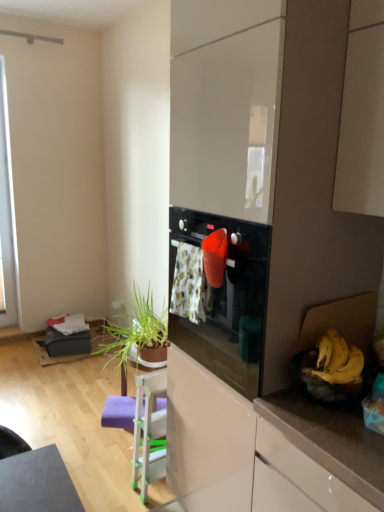
Question: Is the depth of white plastic chair at lower center less than that of floral fabric laundry at center?

Choices:
 (A) yes
 (B) no

Answer: (B)

Question: Would you consider white plastic chair at lower center to be distant from floral fabric laundry at center?

Choices:
 (A) no
 (B) yes

Answer: (A)

Question: From the image's perspective, does white plastic chair at lower center appear higher than floral fabric laundry at center?

Choices:
 (A) yes
 (B) no

Answer: (B)

Question: Is white plastic chair at lower center thinner than floral fabric laundry at center?

Choices:
 (A) yes
 (B) no

Answer: (B)

Question: Considering the relative sizes of white plastic chair at lower center and floral fabric laundry at center in the image provided, is white plastic chair at lower center taller than floral fabric laundry at center?

Choices:
 (A) no
 (B) yes

Answer: (B)

Question: Could you tell me if white plastic chair at lower center is facing floral fabric laundry at center?

Choices:
 (A) yes
 (B) no

Answer: (B)

Question: Does green leafy plant at lower left have a smaller size compared to yellow matte bananas at right?

Choices:
 (A) yes
 (B) no

Answer: (B)

Question: Are green leafy plant at lower left and yellow matte bananas at right far apart?

Choices:
 (A) no
 (B) yes

Answer: (B)

Question: From the image's perspective, is green leafy plant at lower left located above yellow matte bananas at right?

Choices:
 (A) yes
 (B) no

Answer: (B)

Question: From a real-world perspective, is green leafy plant at lower left under yellow matte bananas at right?

Choices:
 (A) yes
 (B) no

Answer: (A)

Question: Is green leafy plant at lower left closer to the viewer compared to yellow matte bananas at right?

Choices:
 (A) no
 (B) yes

Answer: (A)

Question: Considering the relative sizes of green leafy plant at lower left and yellow matte bananas at right in the image provided, is green leafy plant at lower left bigger than yellow matte bananas at right?

Choices:
 (A) no
 (B) yes

Answer: (B)

Question: From a real-world perspective, is yellow matte bananas at right beneath green leafy plant at lower left?

Choices:
 (A) yes
 (B) no

Answer: (B)